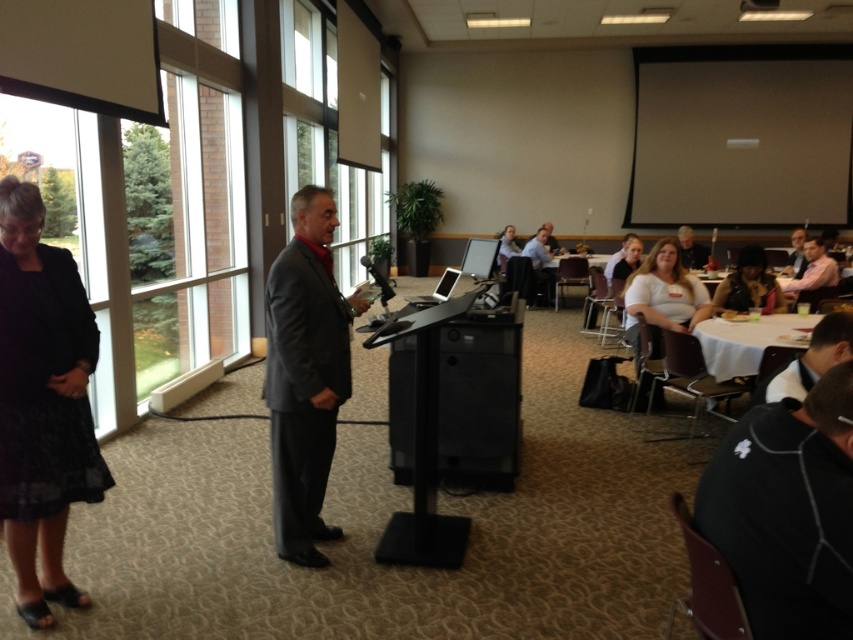
You are attending a presentation in the conference room. The presenter is standing at the black podium. There are two points marked in the room. The first point is at coordinate point (822,282) and the second point is at coordinate point (799,276). If you are facing the presenter, which point is closer to you?

Point (822,282) is in front of point (799,276), so if you are facing the presenter, point (822,282) is closer to you.

You are attending a meeting in the conference room and notice two people standing near the podium. The man in the pink shirt at right and the person in the matte black shirt at center. Which one is closer to the floor?

The pink shirt at right is positioned under the matte black shirt at center, so the pink shirt at right is closer to the floor.

You are sitting in the conference room and want to hand a document to both the person in the pink shirt at right and the matte black shirt at center. Which individual should you approach first to ensure you can reach them without moving from your seat?

The pink shirt at right is closer to the viewer than the matte black shirt at center, so you should approach the pink shirt at right first since they are nearer to your current position.